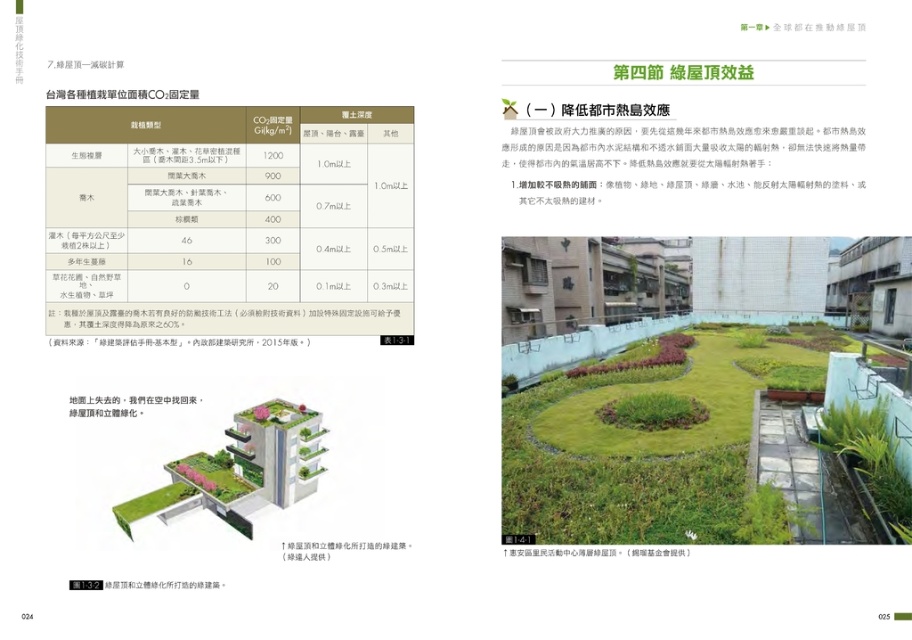
You are reviewing a technical manual and notice two plants in the table section on the left. Which plant is positioned closer to the front of the page between the green grass at upper center and the green leafy plant at upper center?

The green grass at upper center is closer to the front of the page because the green leafy plant at upper center is positioned behind it.

You are designing a green roof and need to choose between the green grass at upper center and the green grass at center based on their height. Which grass type should you select if you want taller grass for aesthetic purposes?

The green grass at upper center should be selected because it has a greater height compared to the green grass at center.